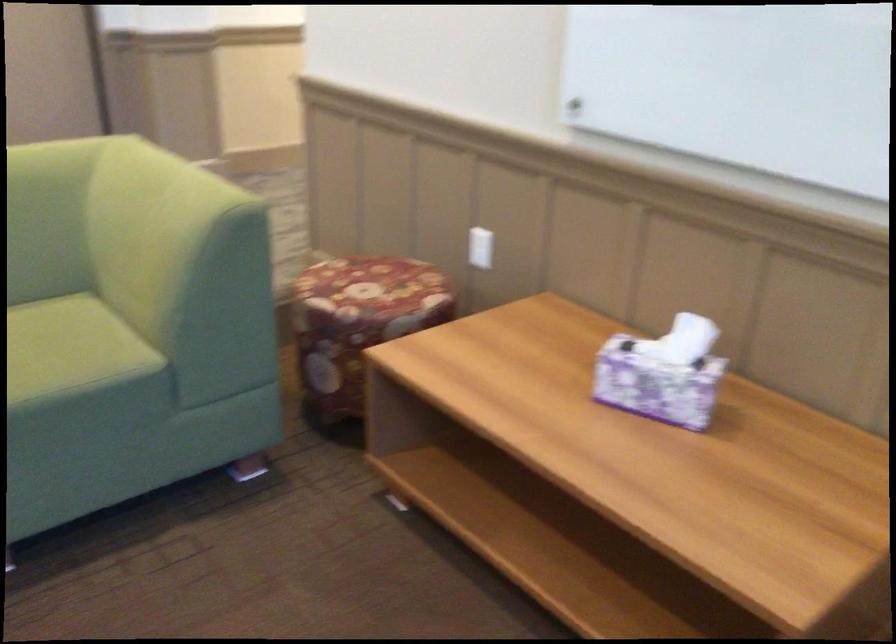
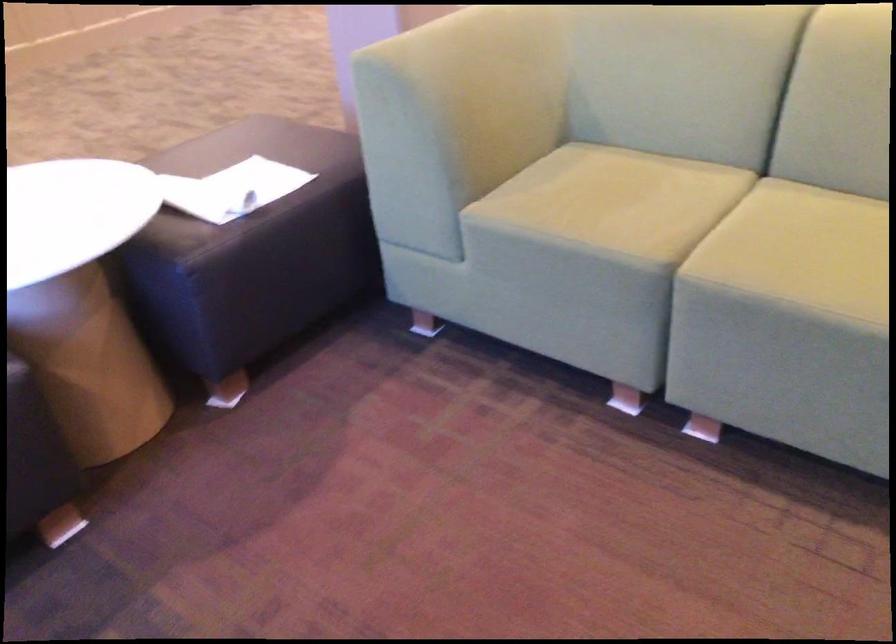
The first image is from the beginning of the video and the second image is from the end. How did the camera likely rotate when shooting the video?

The camera's rotation is toward left-down.